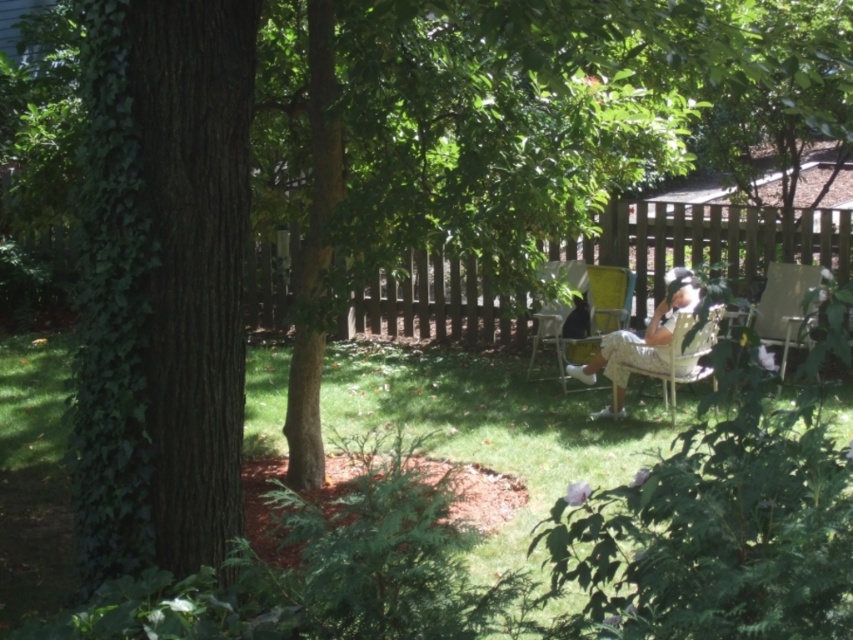
Who is positioned more to the right, wooden chair at right or matte yellow chair at center right?

wooden chair at right

Is point (788, 348) positioned in front of point (589, 342)?

That is True.

What are the coordinates of `wooden chair at right` in the screenshot? It's located at (785, 307).

Which is more to the left, green ivy-covered tree trunk at left or wooden chair at right?

Positioned to the left is green ivy-covered tree trunk at left.

Is the position of green ivy-covered tree trunk at left less distant than that of wooden chair at right?

Yes, green ivy-covered tree trunk at left is closer to the viewer.

Which is in front, point (109, 420) or point (780, 291)?

Point (109, 420) is in front.

Image resolution: width=853 pixels, height=640 pixels. In order to click on green ivy-covered tree trunk at left in this screenshot , I will do `click(161, 284)`.

Looking at this image, is khaki cotton shorts at center above matte yellow chair at center?

Actually, khaki cotton shorts at center is below matte yellow chair at center.

Does point (611, 376) come closer to viewer compared to point (535, 342)?

Yes, it is in front of point (535, 342).

Image resolution: width=853 pixels, height=640 pixels. Find the location of `khaki cotton shorts at center`. khaki cotton shorts at center is located at coordinates (637, 340).